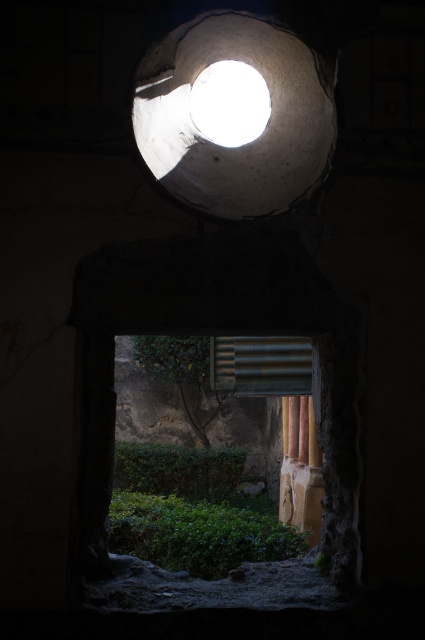
Describe the element at coordinates (244, 145) in the screenshot. I see `white matte hole at upper center` at that location.

The height and width of the screenshot is (640, 425). What do you see at coordinates (244, 145) in the screenshot? I see `white matte hole at upper center` at bounding box center [244, 145].

Locate an element on the screen. The image size is (425, 640). white matte hole at upper center is located at coordinates (244, 145).

Looking at this image, can you confirm if white matte light at upper center is bigger than smooth stone pillar at right?

No, white matte light at upper center is not bigger than smooth stone pillar at right.

Between white matte light at upper center and smooth stone pillar at right, which one is positioned lower?

Positioned lower is smooth stone pillar at right.

You are a GUI agent. You are given a task and a screenshot of the screen. Output one action in this format:
    pyautogui.click(x=<x>, y=<y>)
    Task: Click on the white matte light at upper center
    The width and height of the screenshot is (425, 640).
    Given the screenshot: What is the action you would take?
    pyautogui.click(x=229, y=104)

Does point (237, 54) come farther from viewer compared to point (229, 97)?

That is False.

Measure the distance between point (328, 140) and camera.

A distance of 4.24 meters exists between point (328, 140) and camera.

Locate an element on the screen. white matte hole at upper center is located at coordinates (244, 145).